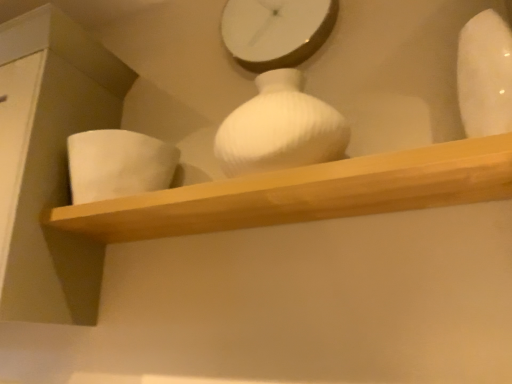
Question: Can you confirm if white glossy clock at upper center is thinner than white matte vase at upper right, the 2th vase in the back-to-front sequence?

Choices:
 (A) yes
 (B) no

Answer: (A)

Question: Does white glossy clock at upper center have a larger size compared to white matte vase at upper right, arranged as the 2th vase when viewed from the left?

Choices:
 (A) no
 (B) yes

Answer: (A)

Question: From the image's perspective, is white glossy clock at upper center beneath white matte vase at upper right, which is the first vase in right-to-left order?

Choices:
 (A) no
 (B) yes

Answer: (A)

Question: Is white glossy clock at upper center positioned with its back to white matte vase at upper right, the 1th vase when ordered from front to back?

Choices:
 (A) no
 (B) yes

Answer: (A)

Question: From the image's perspective, is white glossy clock at upper center on top of white matte vase at upper right, the 2th vase in the back-to-front sequence?

Choices:
 (A) yes
 (B) no

Answer: (A)

Question: Considering the relative sizes of white glossy clock at upper center and white matte vase at upper right, which is the first vase in right-to-left order, in the image provided, is white glossy clock at upper center shorter than white matte vase at upper right, which is the first vase in right-to-left order,?

Choices:
 (A) yes
 (B) no

Answer: (B)

Question: From a real-world perspective, is white matte vase at upper right, the 2th vase in the back-to-front sequence, located higher than white glossy clock at upper center?

Choices:
 (A) no
 (B) yes

Answer: (A)

Question: Does white matte vase at upper right, the 2th vase in the back-to-front sequence, turn towards white glossy clock at upper center?

Choices:
 (A) no
 (B) yes

Answer: (A)

Question: Is white matte vase at upper right, which is the first vase in right-to-left order, far from white glossy clock at upper center?

Choices:
 (A) no
 (B) yes

Answer: (A)

Question: Considering the relative sizes of white matte vase at upper right, which is the first vase in right-to-left order, and white glossy clock at upper center in the image provided, is white matte vase at upper right, which is the first vase in right-to-left order, smaller than white glossy clock at upper center?

Choices:
 (A) yes
 (B) no

Answer: (B)

Question: Is white matte vase at upper right, the 1th vase when ordered from front to back, oriented away from white glossy clock at upper center?

Choices:
 (A) no
 (B) yes

Answer: (A)

Question: Would you say white matte vase at upper right, which is the first vase in right-to-left order, contains white glossy clock at upper center?

Choices:
 (A) no
 (B) yes

Answer: (A)

Question: From a real-world perspective, is wooden shelf at center under white matte vase at left, the second vase in the front-to-back sequence?

Choices:
 (A) yes
 (B) no

Answer: (A)